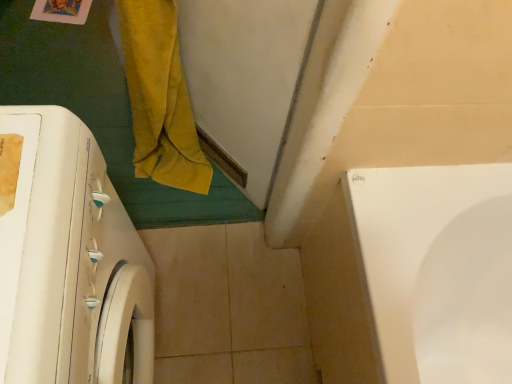
Question: Is yellow velvety bath towel at left inside or outside of white glossy washing machine at left?

Choices:
 (A) inside
 (B) outside

Answer: (B)

Question: Is yellow velvety bath towel at left bigger or smaller than white glossy washing machine at left?

Choices:
 (A) big
 (B) small

Answer: (B)

Question: Does point (169, 11) appear closer or farther from the camera than point (41, 218)?

Choices:
 (A) farther
 (B) closer

Answer: (A)

Question: From the image's perspective, relative to yellow velvety bath towel at left, is white glossy washing machine at left above or below?

Choices:
 (A) below
 (B) above

Answer: (A)

Question: In terms of height, does white glossy washing machine at left look taller or shorter compared to yellow velvety bath towel at left?

Choices:
 (A) short
 (B) tall

Answer: (B)

Question: Which is correct: white glossy washing machine at left is inside yellow velvety bath towel at left, or outside of it?

Choices:
 (A) outside
 (B) inside

Answer: (A)

Question: Would you say white glossy washing machine at left is to the left or to the right of yellow velvety bath towel at left in the picture?

Choices:
 (A) left
 (B) right

Answer: (A)